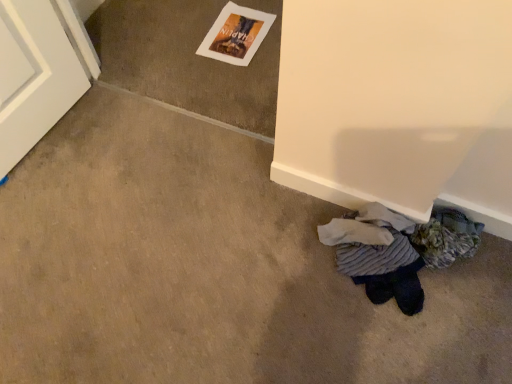
This screenshot has height=384, width=512. Describe the element at coordinates (236, 34) in the screenshot. I see `matte paper postcard at upper center` at that location.

This screenshot has height=384, width=512. What are the coordinates of `matte paper postcard at upper center` in the screenshot? It's located at (236, 34).

Where is `matte paper postcard at upper center`? This screenshot has height=384, width=512. matte paper postcard at upper center is located at coordinates (236, 34).